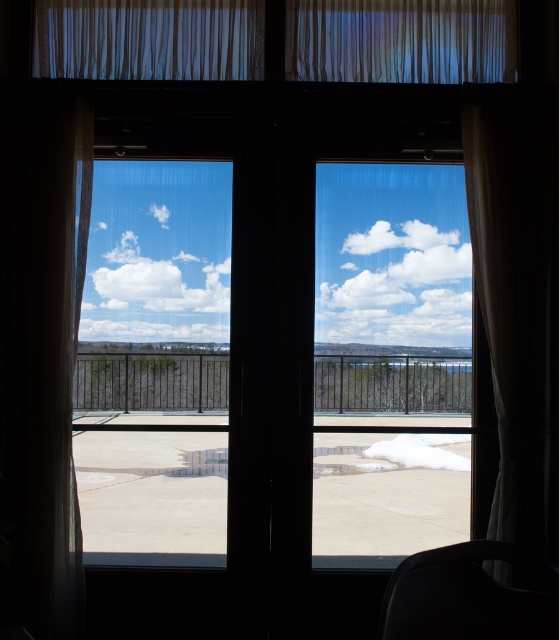
Is point (339, 44) in front of point (498, 545)?

No, it is not.

Is satin white curtains at upper center to the right of dark gray fabric chair at lower right from the viewer's perspective?

No, satin white curtains at upper center is not to the right of dark gray fabric chair at lower right.

Where is `satin white curtains at upper center`? The height and width of the screenshot is (640, 559). satin white curtains at upper center is located at coordinates (400, 40).

Is smooth concrete tarmac at center above white sheer curtain at upper center?

No, smooth concrete tarmac at center is not above white sheer curtain at upper center.

Which is behind, point (105, 531) or point (442, 60)?

The point (105, 531) is behind.

What do you see at coordinates (387, 490) in the screenshot? I see `smooth concrete tarmac at center` at bounding box center [387, 490].

This screenshot has height=640, width=559. I want to click on smooth concrete tarmac at center, so click(387, 490).

Can you confirm if smooth concrete tarmac at center is positioned to the right of white sheer curtain at right?

No, smooth concrete tarmac at center is not to the right of white sheer curtain at right.

What do you see at coordinates (387, 490) in the screenshot?
I see `smooth concrete tarmac at center` at bounding box center [387, 490].

Which is in front, point (457, 522) or point (518, 285)?

Point (518, 285)

You are a GUI agent. You are given a task and a screenshot of the screen. Output one action in this format:
    pyautogui.click(x=<x>, y=<y>)
    Task: Click on the smooth concrete tarmac at center
    Image resolution: width=559 pixels, height=640 pixels.
    Given the screenshot: What is the action you would take?
    pyautogui.click(x=387, y=490)